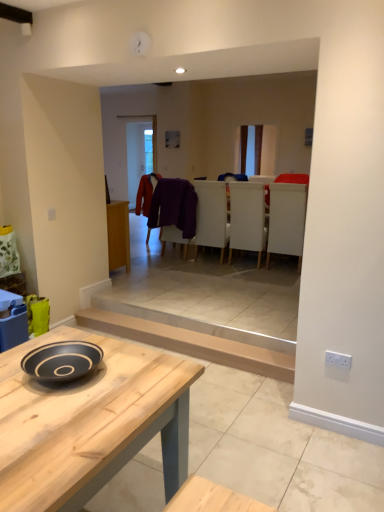
Question: Is velvet red coat at center, which is the 2th laundry from front to back, looking in the opposite direction of natural wood table at center?

Choices:
 (A) no
 (B) yes

Answer: (A)

Question: Can natural wood table at center be found inside velvet red coat at center, the first laundry positioned from the back?

Choices:
 (A) yes
 (B) no

Answer: (B)

Question: Is velvet red coat at center, the first laundry positioned from the back, positioned far away from natural wood table at center?

Choices:
 (A) yes
 (B) no

Answer: (A)

Question: Considering the relative positions of velvet red coat at center, the first laundry positioned from the back, and natural wood table at center in the image provided, is velvet red coat at center, the first laundry positioned from the back, to the right of natural wood table at center from the viewer's perspective?

Choices:
 (A) no
 (B) yes

Answer: (A)

Question: Does velvet red coat at center, the first laundry positioned from the back, have a greater width compared to natural wood table at center?

Choices:
 (A) yes
 (B) no

Answer: (B)

Question: Is velvet red coat at center, the first laundry positioned from the back, closer to the viewer compared to natural wood table at center?

Choices:
 (A) yes
 (B) no

Answer: (B)

Question: Is white leather armchair at center, positioned as the first armchair in left-to-right order, further to camera compared to white fabric armchair at center, which is counted as the 2th armchair, starting from the left?

Choices:
 (A) no
 (B) yes

Answer: (B)

Question: Considering the relative sizes of white leather armchair at center, positioned as the first armchair in left-to-right order, and white fabric armchair at center, the 1th armchair from the right, in the image provided, is white leather armchair at center, positioned as the first armchair in left-to-right order, shorter than white fabric armchair at center, the 1th armchair from the right,?

Choices:
 (A) no
 (B) yes

Answer: (B)

Question: Can you confirm if white leather armchair at center, positioned as the first armchair in left-to-right order, is taller than white fabric armchair at center, which is counted as the 2th armchair, starting from the left?

Choices:
 (A) yes
 (B) no

Answer: (B)

Question: Does white leather armchair at center, positioned as the first armchair in left-to-right order, come in front of white fabric armchair at center, the 1th armchair from the right?

Choices:
 (A) yes
 (B) no

Answer: (B)

Question: Is white leather armchair at center, positioned as the first armchair in left-to-right order, not inside white fabric armchair at center, which is counted as the 2th armchair, starting from the left?

Choices:
 (A) no
 (B) yes

Answer: (B)

Question: From a real-world perspective, does white leather armchair at center, positioned as the first armchair in left-to-right order, sit lower than white fabric armchair at center, which is counted as the 2th armchair, starting from the left?

Choices:
 (A) yes
 (B) no

Answer: (A)

Question: Is light brown wooden plank at lower center surrounded by white fabric armchair at center, which is counted as the 2th armchair, starting from the left?

Choices:
 (A) no
 (B) yes

Answer: (A)